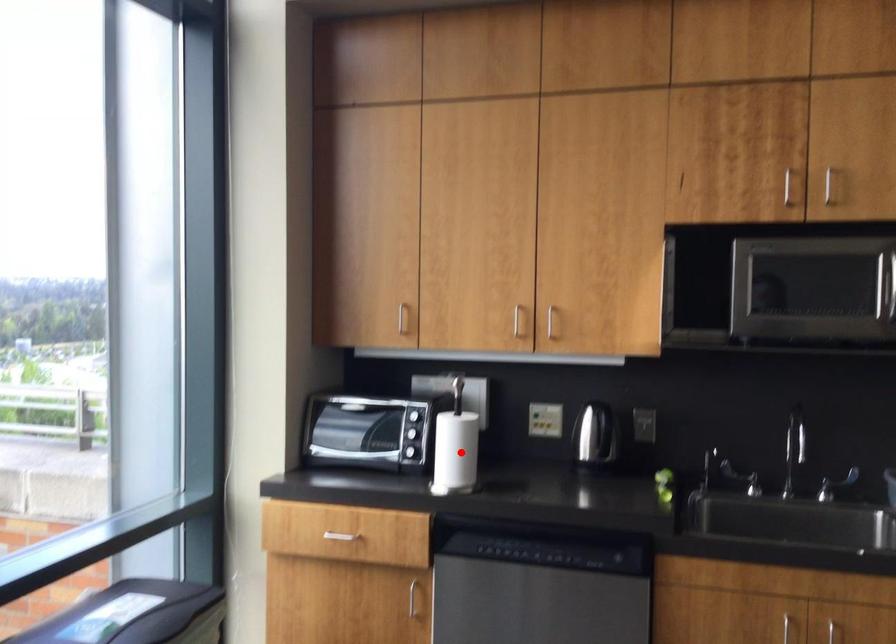
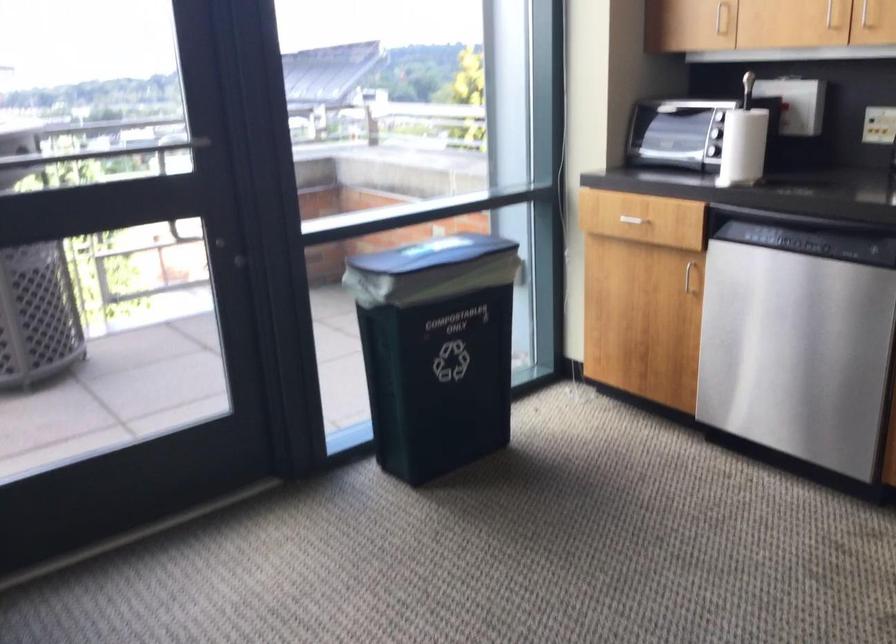
The point at the highlighted location is marked in the first image. Where is the corresponding point in the second image?

(743, 146)